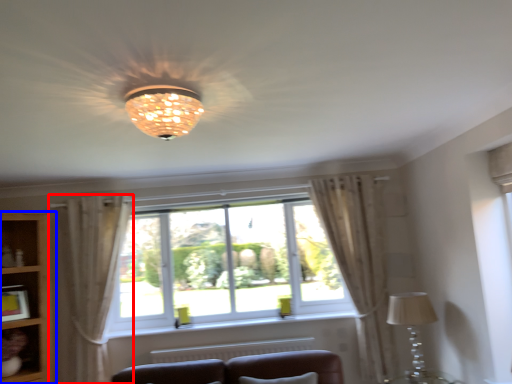
Question: Among these objects, which one is nearest to the camera, curtain (highlighted by a red box) or bookshelf (highlighted by a blue box)?

Choices:
 (A) curtain
 (B) bookshelf

Answer: (B)